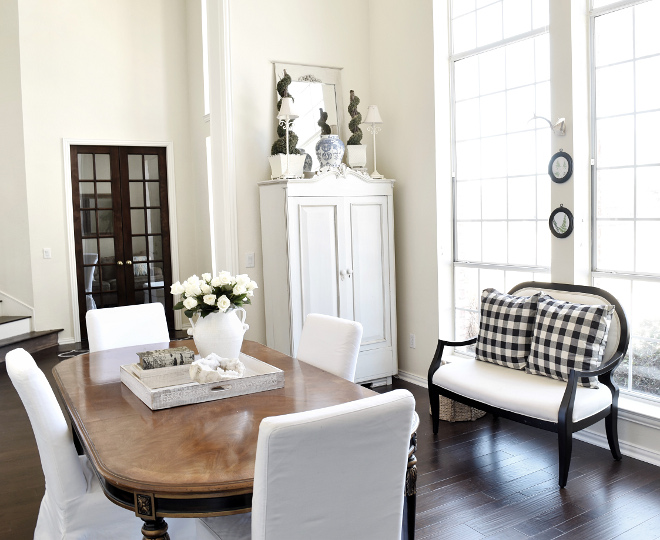
Locate an element on the screen. This screenshot has width=660, height=540. bench is located at coordinates (542, 395).